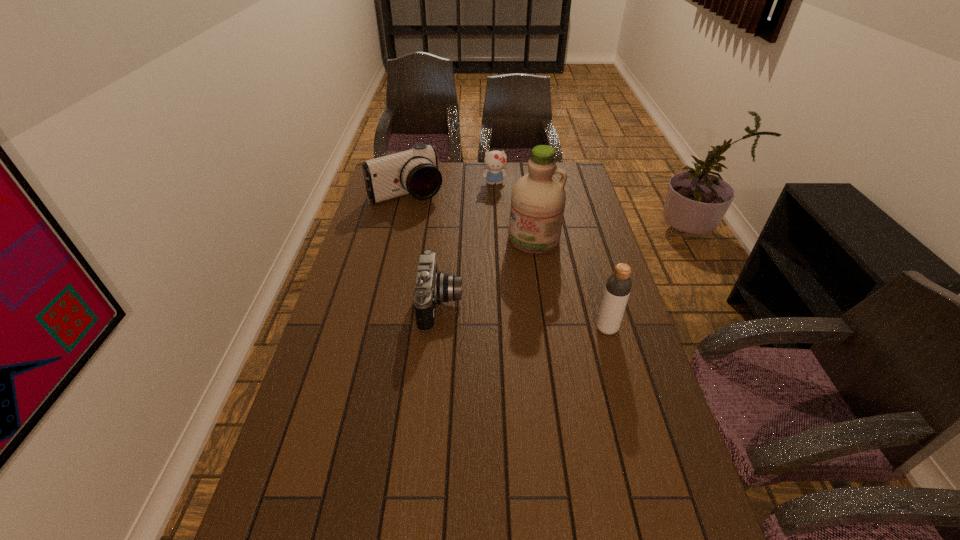
Identify the location of vacant spot on the desktop that is between the camera and the second tallest object and is positioned on the front-facing side of the kitten. click(512, 315).

Identify the location of vacant spot on the desktop that is between the camera and the second tallest object and is positioned on the front label of the tallest object. (502, 313).

Locate an element on the screen. The width and height of the screenshot is (960, 540). free spot on the desktop that is between the camera and the bottle and is positioned on the surface of the camcorder is located at coordinates (514, 315).